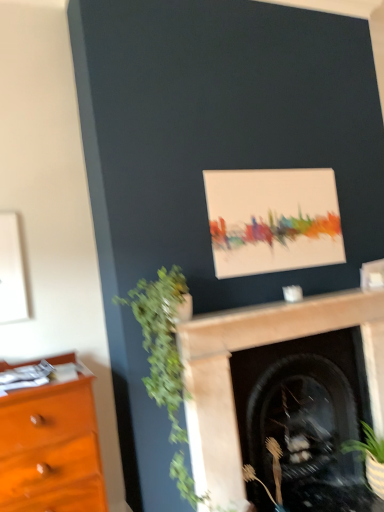
Where is `matte canvas painting at upper center`? matte canvas painting at upper center is located at coordinates (273, 220).

Is point (143, 291) positioned in front of point (373, 379)?

Yes.

Considering the relative positions of green leafy plant at left, placed as the second plant when sorted from bottom to top, and smooth stone fireplace at center in the image provided, is green leafy plant at left, placed as the second plant when sorted from bottom to top, to the right of smooth stone fireplace at center from the viewer's perspective?

Incorrect, green leafy plant at left, placed as the second plant when sorted from bottom to top, is not on the right side of smooth stone fireplace at center.

From a real-world perspective, is green leafy plant at left, placed as the second plant when sorted from bottom to top, under smooth stone fireplace at center?

No, from a real-world perspective, green leafy plant at left, placed as the second plant when sorted from bottom to top, is not beneath smooth stone fireplace at center.

Is green leafy plant at left, which is the first plant in top-to-bottom order, bigger or smaller than smooth stone fireplace at center?

green leafy plant at left, which is the first plant in top-to-bottom order, is smaller than smooth stone fireplace at center.

Which is more to the left, brown textured plant at lower center, the 2th plant when ordered from top to bottom, or matte canvas painting at upper center?

brown textured plant at lower center, the 2th plant when ordered from top to bottom.

From a real-world perspective, between brown textured plant at lower center, the 2th plant viewed from the left, and matte canvas painting at upper center, who is vertically lower?

In real-world perspective, brown textured plant at lower center, the 2th plant viewed from the left, is lower.

The height and width of the screenshot is (512, 384). Find the location of `picture frame above the brown textured plant at lower center, the 2th plant viewed from the left (from a real-world perspective)`. picture frame above the brown textured plant at lower center, the 2th plant viewed from the left (from a real-world perspective) is located at coordinates (273, 220).

From the image's perspective, is smooth stone fireplace at center above or below green leafy plant at left, which ranks as the 1th plant in left-to-right order?

smooth stone fireplace at center is situated lower than green leafy plant at left, which ranks as the 1th plant in left-to-right order, in the image.

Does point (196, 373) come behind point (145, 334)?

Yes, point (196, 373) is behind point (145, 334).

From a real-world perspective, is smooth stone fireplace at center physically below green leafy plant at left, which ranks as the 1th plant in left-to-right order?

Correct, in the physical world, smooth stone fireplace at center is lower than green leafy plant at left, which ranks as the 1th plant in left-to-right order.

Does smooth stone fireplace at center touch green leafy plant at left, which ranks as the 1th plant in left-to-right order?

No, smooth stone fireplace at center is not making contact with green leafy plant at left, which ranks as the 1th plant in left-to-right order.

From a real-world perspective, who is located higher, smooth stone fireplace at center or brown textured plant at lower center, the 2th plant viewed from the left?

smooth stone fireplace at center.

Are smooth stone fireplace at center and brown textured plant at lower center, acting as the first plant starting from the right, beside each other?

No, smooth stone fireplace at center is not making contact with brown textured plant at lower center, acting as the first plant starting from the right.

Considering the sizes of objects smooth stone fireplace at center and brown textured plant at lower center, the 1th plant when ordered from bottom to top, in the image provided, who is wider, smooth stone fireplace at center or brown textured plant at lower center, the 1th plant when ordered from bottom to top,?

With larger width is brown textured plant at lower center, the 1th plant when ordered from bottom to top.

From the image's perspective, is smooth stone fireplace at center beneath brown textured plant at lower center, the 1th plant when ordered from bottom to top?

Actually, smooth stone fireplace at center appears above brown textured plant at lower center, the 1th plant when ordered from bottom to top, in the image.

Which of these two, brown textured plant at lower center, the 1th plant when ordered from bottom to top, or green leafy plant at left, placed as the second plant when sorted from bottom to top, stands taller?

With more height is green leafy plant at left, placed as the second plant when sorted from bottom to top.

How far apart are brown textured plant at lower center, the 2th plant viewed from the left, and green leafy plant at left, arranged as the 2th plant when viewed from the right?

brown textured plant at lower center, the 2th plant viewed from the left, is 26.51 inches away from green leafy plant at left, arranged as the 2th plant when viewed from the right.

Is brown textured plant at lower center, the 1th plant when ordered from bottom to top, facing away from green leafy plant at left, which ranks as the 1th plant in left-to-right order?

No.

Which object is closer to the camera, brown textured plant at lower center, the 2th plant when ordered from top to bottom, or green leafy plant at left, which ranks as the 1th plant in left-to-right order?

green leafy plant at left, which ranks as the 1th plant in left-to-right order.

Is smooth stone fireplace at center taller than matte canvas painting at upper center?

Indeed, smooth stone fireplace at center has a greater height compared to matte canvas painting at upper center.

Does smooth stone fireplace at center have a larger size compared to matte canvas painting at upper center?

Correct, smooth stone fireplace at center is larger in size than matte canvas painting at upper center.

Looking at their sizes, would you say smooth stone fireplace at center is wider or thinner than matte canvas painting at upper center?

smooth stone fireplace at center is wider than matte canvas painting at upper center.

From the image's perspective, does smooth stone fireplace at center appear lower than matte canvas painting at upper center?

Yes, from the image's perspective, smooth stone fireplace at center is beneath matte canvas painting at upper center.

Locate an element on the screen. The width and height of the screenshot is (384, 512). plant that is above the brown textured plant at lower center, the 2th plant when ordered from top to bottom (from a real-world perspective) is located at coordinates (165, 360).

Is green leafy plant at left, which ranks as the 1th plant in left-to-right order, to the right of brown textured plant at lower center, acting as the first plant starting from the right, from the viewer's perspective?

No.

From the image's perspective, is green leafy plant at left, arranged as the 2th plant when viewed from the right, above or below brown textured plant at lower center, the 2th plant when ordered from top to bottom?

From the image's perspective, green leafy plant at left, arranged as the 2th plant when viewed from the right, appears above brown textured plant at lower center, the 2th plant when ordered from top to bottom.

From a real-world perspective, relative to brown textured plant at lower center, the 1th plant when ordered from bottom to top, is green leafy plant at left, placed as the second plant when sorted from bottom to top, vertically above or below?

green leafy plant at left, placed as the second plant when sorted from bottom to top, is above brown textured plant at lower center, the 1th plant when ordered from bottom to top.

At what (x,y) coordinates should I click in order to perform the action: click on fireplace below the green leafy plant at left, which is the first plant in top-to-bottom order (from a real-world perspective). Please return your answer as a coordinate pair (x, y). Looking at the image, I should click on (256, 351).

This screenshot has height=512, width=384. In order to click on picture frame on the right of brown textured plant at lower center, the 1th plant when ordered from bottom to top in this screenshot , I will do `click(273, 220)`.

Considering their positions, is green leafy plant at left, placed as the second plant when sorted from bottom to top, positioned further to matte canvas painting at upper center than brown textured plant at lower center, the 2th plant when ordered from top to bottom?

brown textured plant at lower center, the 2th plant when ordered from top to bottom, is positioned further to the anchor matte canvas painting at upper center.

When comparing their distances from matte canvas painting at upper center, does brown textured plant at lower center, the 2th plant viewed from the left, or smooth stone fireplace at center seem closer?

Based on the image, smooth stone fireplace at center appears to be nearer to matte canvas painting at upper center.

Which object lies nearer to the anchor point matte canvas painting at upper center, green leafy plant at left, arranged as the 2th plant when viewed from the right, or smooth stone fireplace at center?

smooth stone fireplace at center is positioned closer to the anchor matte canvas painting at upper center.

Based on their spatial positions, is matte canvas painting at upper center or green leafy plant at left, which is the first plant in top-to-bottom order, further from brown textured plant at lower center, acting as the first plant starting from the right?

matte canvas painting at upper center is positioned further to the anchor brown textured plant at lower center, acting as the first plant starting from the right.

Consider the image. Considering their positions, is brown textured plant at lower center, the 1th plant when ordered from bottom to top, positioned further to smooth stone fireplace at center than green leafy plant at left, which ranks as the 1th plant in left-to-right order?

brown textured plant at lower center, the 1th plant when ordered from bottom to top.

Considering their positions, is smooth stone fireplace at center positioned further to green leafy plant at left, which is the first plant in top-to-bottom order, than brown textured plant at lower center, the 1th plant when ordered from bottom to top?

brown textured plant at lower center, the 1th plant when ordered from bottom to top, lies further to green leafy plant at left, which is the first plant in top-to-bottom order, than the other object.

Looking at the image, which one is located closer to brown textured plant at lower center, the 2th plant when ordered from top to bottom, green leafy plant at left, arranged as the 2th plant when viewed from the right, or matte canvas painting at upper center?

Among the two, green leafy plant at left, arranged as the 2th plant when viewed from the right, is located nearer to brown textured plant at lower center, the 2th plant when ordered from top to bottom.

Looking at the image, which one is located closer to smooth stone fireplace at center, green leafy plant at left, which is the first plant in top-to-bottom order, or brown textured plant at lower center, the 2th plant when ordered from top to bottom?

Based on the image, green leafy plant at left, which is the first plant in top-to-bottom order, appears to be nearer to smooth stone fireplace at center.

Identify the location of plant between green leafy plant at left, placed as the second plant when sorted from bottom to top, and smooth stone fireplace at center from left to right. This screenshot has height=512, width=384. (273, 473).

Where is `plant between matte canvas painting at upper center and smooth stone fireplace at center in the vertical direction`? This screenshot has height=512, width=384. plant between matte canvas painting at upper center and smooth stone fireplace at center in the vertical direction is located at coordinates (165, 360).

Where is `plant between matte canvas painting at upper center and brown textured plant at lower center, the 2th plant when ordered from top to bottom, in the vertical direction`? This screenshot has width=384, height=512. plant between matte canvas painting at upper center and brown textured plant at lower center, the 2th plant when ordered from top to bottom, in the vertical direction is located at coordinates (165, 360).

Identify the location of fireplace between matte canvas painting at upper center and brown textured plant at lower center, the 2th plant when ordered from top to bottom, vertically. This screenshot has height=512, width=384. (256, 351).